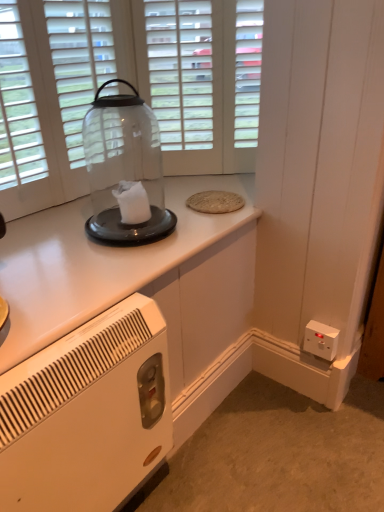
Locate an element on the screen. Image resolution: width=384 pixels, height=512 pixels. blank area to the left of transparent glass jar at center is located at coordinates (46, 231).